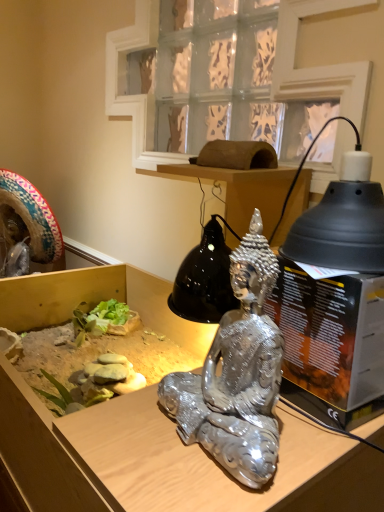
From the picture: What is the approximate width of metallic statue at center?

→ It is 24.59 inches.

Identify the location of metallic statue at center. (168, 460).

The height and width of the screenshot is (512, 384). I want to click on metallic statue at center, so click(x=168, y=460).

Which object is thinner, black matte lampshade at upper right or clear glass window at upper center?

With smaller width is clear glass window at upper center.

From their relative heights in the image, would you say black matte lampshade at upper right is taller or shorter than clear glass window at upper center?

In the image, black matte lampshade at upper right appears to be shorter than clear glass window at upper center.

Is black matte lampshade at upper right bigger than clear glass window at upper center?

Incorrect, black matte lampshade at upper right is not larger than clear glass window at upper center.

How different are the orientations of black matte lampshade at upper right and clear glass window at upper center in degrees?

black matte lampshade at upper right and clear glass window at upper center are facing 3.53 degrees away from each other.

From the image's perspective, which is above, shiny silver statue at center or clear glass window at upper center?

From the image's view, clear glass window at upper center is above.

Looking at this image, between shiny silver statue at center and clear glass window at upper center, which one appears on the right side from the viewer's perspective?

clear glass window at upper center is more to the right.

In the scene shown: Would you say shiny silver statue at center is inside or outside clear glass window at upper center?

shiny silver statue at center cannot be found inside clear glass window at upper center.

Consider the image. Would you consider shiny silver statue at center to be distant from clear glass window at upper center?

shiny silver statue at center is near clear glass window at upper center, not far away.

Could black matte lampshade at upper right be considered to be inside clear glass window at upper center?

No, clear glass window at upper center does not contain black matte lampshade at upper right.

From the picture: Would you consider clear glass window at upper center to be distant from black matte lampshade at upper right?

Actually, clear glass window at upper center and black matte lampshade at upper right are a little close together.

Is clear glass window at upper center behind black matte lampshade at upper right?

Yes.

Between black matte lampshade at upper right and metallic statue at center, which one has less height?

black matte lampshade at upper right is shorter.

How much distance is there between black matte lampshade at upper right and metallic statue at center?

The distance of black matte lampshade at upper right from metallic statue at center is 14.03 inches.

Is black matte lampshade at upper right not inside metallic statue at center?

black matte lampshade at upper right is positioned outside metallic statue at center.

From a real-world perspective, is black matte lampshade at upper right on metallic statue at center?

Yes, from a real-world perspective, black matte lampshade at upper right is over metallic statue at center

Relative to shiny silver statue at center, is clear glass window at upper center in front or behind?

clear glass window at upper center is behind shiny silver statue at center.

Locate an element on the screen. window above the shiny silver statue at center (from the image's perspective) is located at coordinates (325, 67).

Considering the sizes of objects clear glass window at upper center and shiny silver statue at center in the image provided, who is taller, clear glass window at upper center or shiny silver statue at center?

clear glass window at upper center.

Which of these two, clear glass window at upper center or shiny silver statue at center, is thinner?

With smaller width is shiny silver statue at center.

At what (x,y) coordinates should I click in order to perform the action: click on lamp on the right of shiny silver statue at center. Please return your answer as a coordinate pair (x, y). Looking at the image, I should click on (341, 219).

Do you think black matte lampshade at upper right is within shiny silver statue at center, or outside of it?

black matte lampshade at upper right lies outside shiny silver statue at center.

Considering the relative positions of black matte lampshade at upper right and shiny silver statue at center in the image provided, is black matte lampshade at upper right to the left or to the right of shiny silver statue at center?

Clearly, black matte lampshade at upper right is on the right of shiny silver statue at center in the image.

Considering the sizes of objects black matte lampshade at upper right and shiny silver statue at center in the image provided, who is taller, black matte lampshade at upper right or shiny silver statue at center?

With more height is shiny silver statue at center.

Who is smaller, metallic statue at center or shiny silver statue at center?

Smaller between the two is shiny silver statue at center.

Which object is further away from the camera, metallic statue at center or shiny silver statue at center?

shiny silver statue at center.

What's the angular difference between metallic statue at center and shiny silver statue at center's facing directions?

The angle between the facing direction of metallic statue at center and the facing direction of shiny silver statue at center is 1.32 degrees.

Would you say metallic statue at center is inside or outside shiny silver statue at center?

metallic statue at center is not inside shiny silver statue at center, it's outside.

The image size is (384, 512). What are the coordinates of `lamp that appears in front of the clear glass window at upper center` in the screenshot? It's located at (341, 219).

The height and width of the screenshot is (512, 384). I want to click on window that is above the shiny silver statue at center (from a real-world perspective), so click(325, 67).

Estimate the real-world distances between objects in this image. Which object is closer to black matte lampshade at upper right, metallic statue at center or clear glass window at upper center?

The object closer to black matte lampshade at upper right is metallic statue at center.

Based on the photo, looking at the image, which one is located further to shiny silver statue at center, clear glass window at upper center or black matte lampshade at upper right?

clear glass window at upper center is further to shiny silver statue at center.

Looking at the image, which one is located further to black matte lampshade at upper right, shiny silver statue at center or clear glass window at upper center?

Based on the image, clear glass window at upper center appears to be further to black matte lampshade at upper right.

Based on their spatial positions, is metallic statue at center or clear glass window at upper center further from shiny silver statue at center?

clear glass window at upper center.

Which object lies further to the anchor point clear glass window at upper center, black matte lampshade at upper right or metallic statue at center?

metallic statue at center is further to clear glass window at upper center.

Which object lies nearer to the anchor point shiny silver statue at center, metallic statue at center or black matte lampshade at upper right?

metallic statue at center is closer to shiny silver statue at center.

Looking at the image, which one is located further to shiny silver statue at center, clear glass window at upper center or metallic statue at center?

clear glass window at upper center lies further to shiny silver statue at center than the other object.

From the image, which object appears to be farther from metallic statue at center, clear glass window at upper center or shiny silver statue at center?

Based on the image, clear glass window at upper center appears to be further to metallic statue at center.

Locate an element on the screen. lamp between clear glass window at upper center and shiny silver statue at center from top to bottom is located at coordinates (341, 219).

Find the location of `lamp between clear glass window at upper center and metallic statue at center in the up-down direction`. lamp between clear glass window at upper center and metallic statue at center in the up-down direction is located at coordinates (341, 219).

At what (x,y) coordinates should I click in order to perform the action: click on person between clear glass window at upper center and metallic statue at center in the vertical direction. Please return your answer as a coordinate pair (x, y). Looking at the image, I should click on (237, 374).

The height and width of the screenshot is (512, 384). Find the location of `person between metallic statue at center and black matte lampshade at upper right in the horizontal direction`. person between metallic statue at center and black matte lampshade at upper right in the horizontal direction is located at coordinates (237, 374).